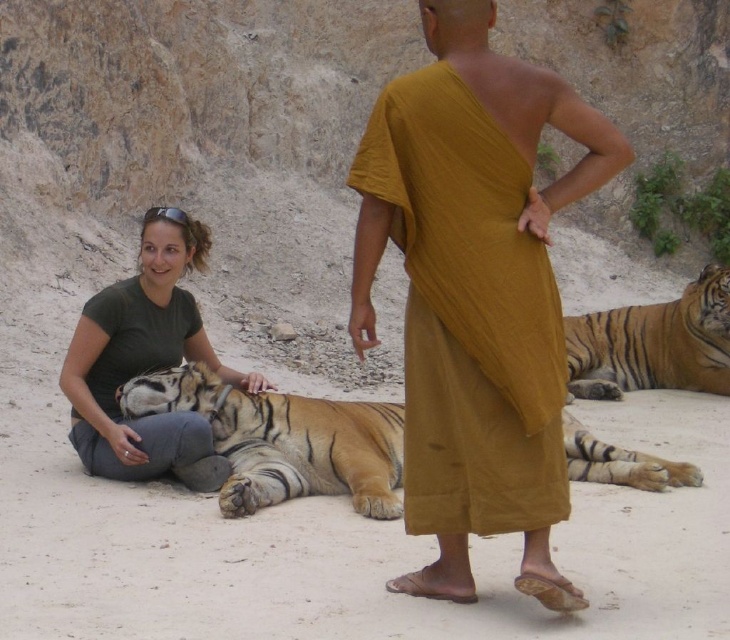
Question: Which point is farther to the camera?

Choices:
 (A) (469, 365)
 (B) (177, 452)
 (C) (576, 336)
 (D) (174, 408)

Answer: (C)

Question: Among these points, which one is farthest from the camera?

Choices:
 (A) (312, 401)
 (B) (407, 134)
 (C) (77, 419)

Answer: (A)

Question: Is orange-brown fur tiger at center thinner than green matte shirt at lower left?

Choices:
 (A) no
 (B) yes

Answer: (B)

Question: Which object is closer to the camera taking this photo?

Choices:
 (A) orange striped tiger at lower right
 (B) orange-brown fur tiger at center
 (C) mustard fabric robe at center

Answer: (C)

Question: Can you confirm if mustard fabric robe at center is wider than orange striped tiger at lower right?

Choices:
 (A) yes
 (B) no

Answer: (B)

Question: Can you confirm if mustard fabric robe at center is positioned below orange striped tiger at lower right?

Choices:
 (A) no
 (B) yes

Answer: (A)